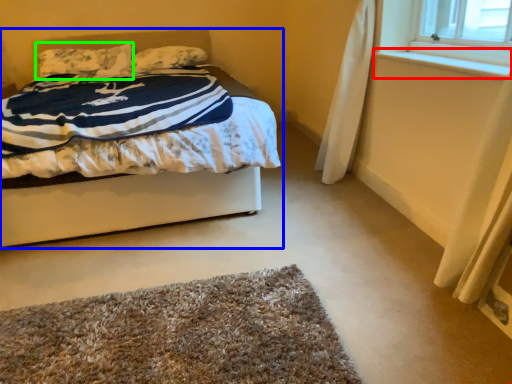
Question: Which object is the closest to the window sill (highlighted by a red box)? Choose among these: bed (highlighted by a blue box) or pillow (highlighted by a green box).

Choices:
 (A) bed
 (B) pillow

Answer: (A)